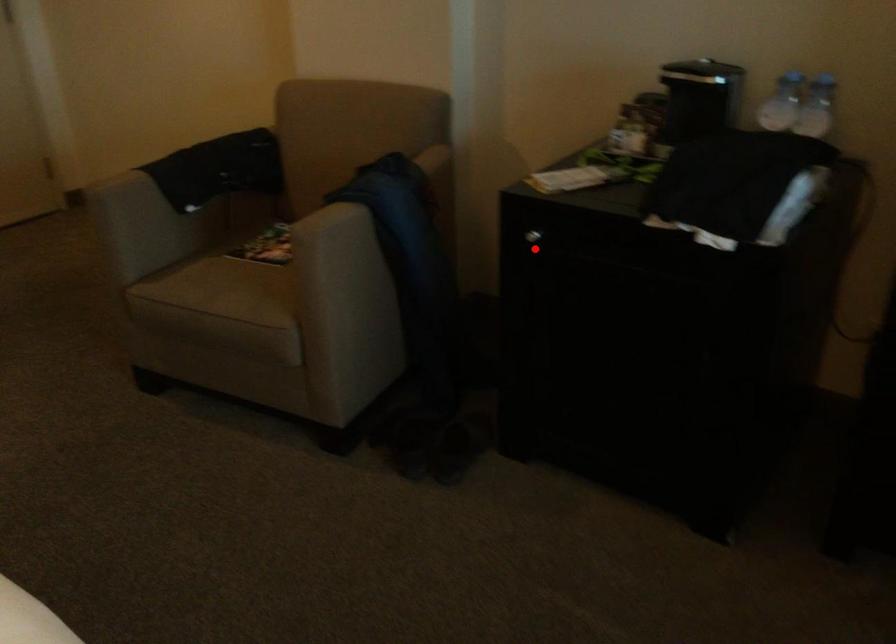
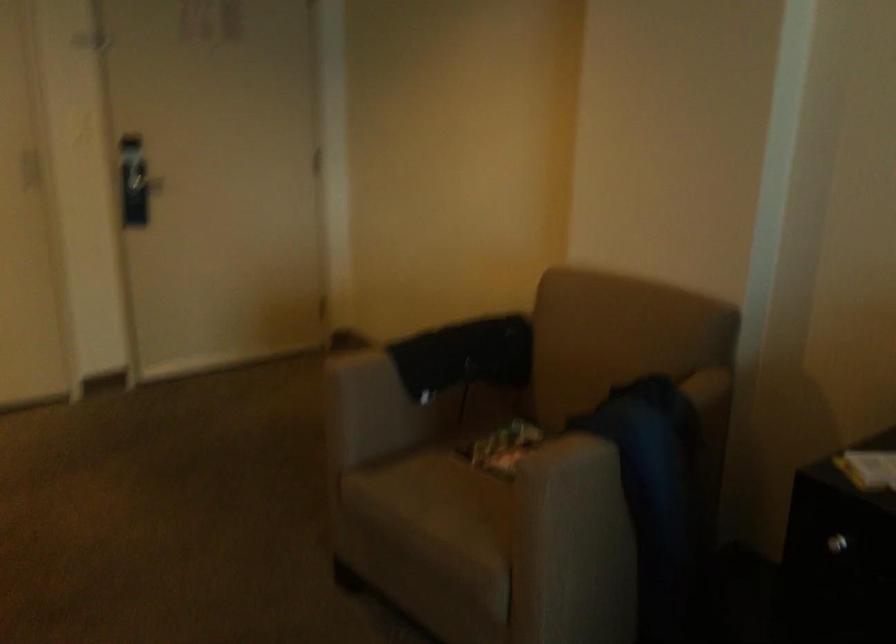
Question: I am providing you with two images of the same scene from different viewpoints. In image1, a red point is highlighted. Considering the same 3D point in image2, which of the following is correct?

Choices:
 (A) It is closer
 (B) It is farther

Answer: (A)